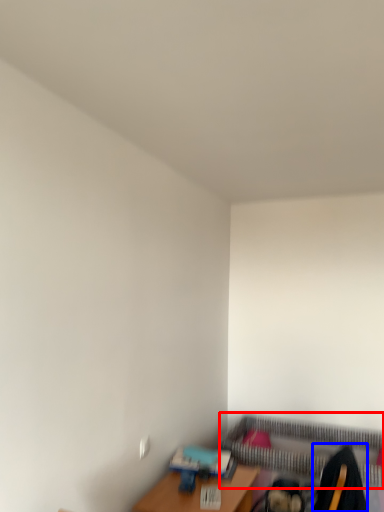
Question: Which object is further to the camera taking this photo, bed frame (highlighted by a red box) or swivel chair (highlighted by a blue box)?

Choices:
 (A) bed frame
 (B) swivel chair

Answer: (A)